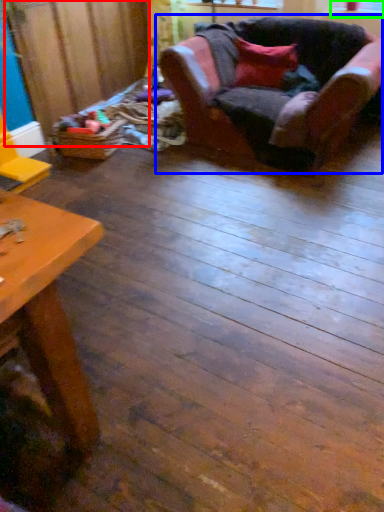
Question: Considering the real-world distances, which object is farthest from plywood (highlighted by a red box)? chair (highlighted by a blue box) or window screen (highlighted by a green box)?

Choices:
 (A) chair
 (B) window screen

Answer: (B)